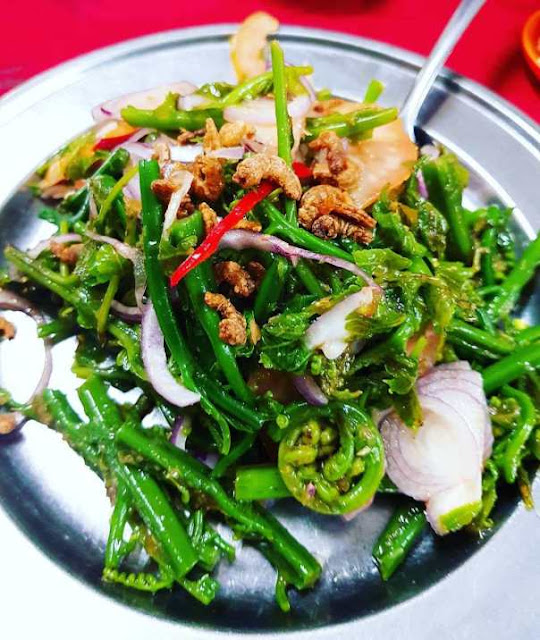
The image size is (540, 640). I want to click on silverware, so click(x=423, y=66).